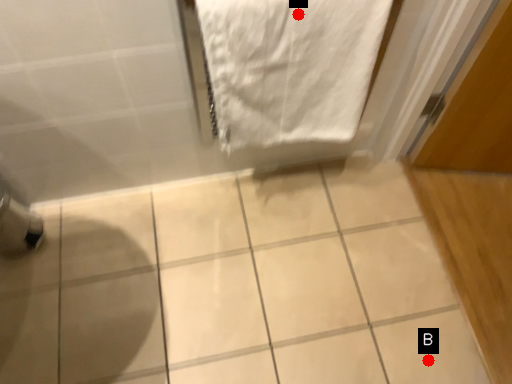
Question: Two points are circled on the image, labeled by A and B beside each circle. Which point is farther to the camera?

Choices:
 (A) A is further
 (B) B is further

Answer: (B)